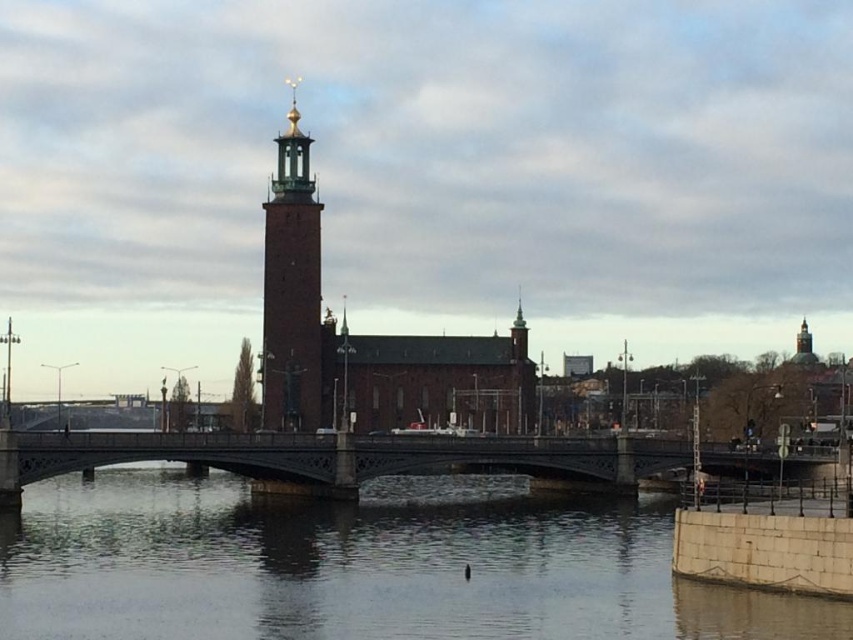
You are a tourist standing on the stone bridge and see the clear water at bridge center and the brick tower at center. Which object is larger in size?

The brick tower at center is larger than the clear water at bridge center.

You are standing on the dark gray stone bridge at center and want to walk to the brick tower at center. Which direction should you face to move towards it?

Since the dark gray stone bridge at center is closer to the viewer than the brick tower at center, you should face away from your current position towards the brick tower at center, which is further back in the scene.